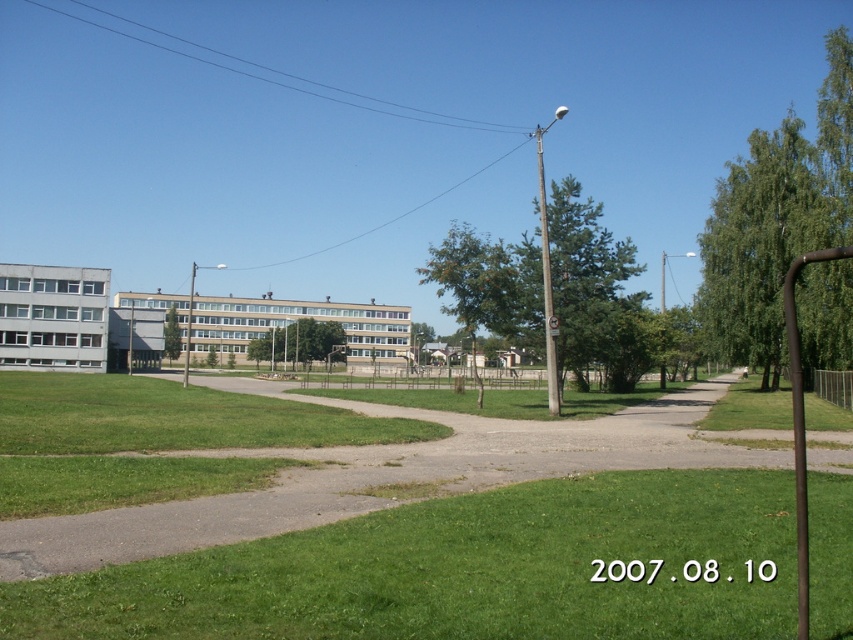
You are a hiker standing at the start of the gravel path at center. You want to reach the brown wooden pole at right. Which direction should you walk to get there?

The gravel path at center is in front of the brown wooden pole at right, so you should walk forward along the gravel path at center to reach the brown wooden pole at right.